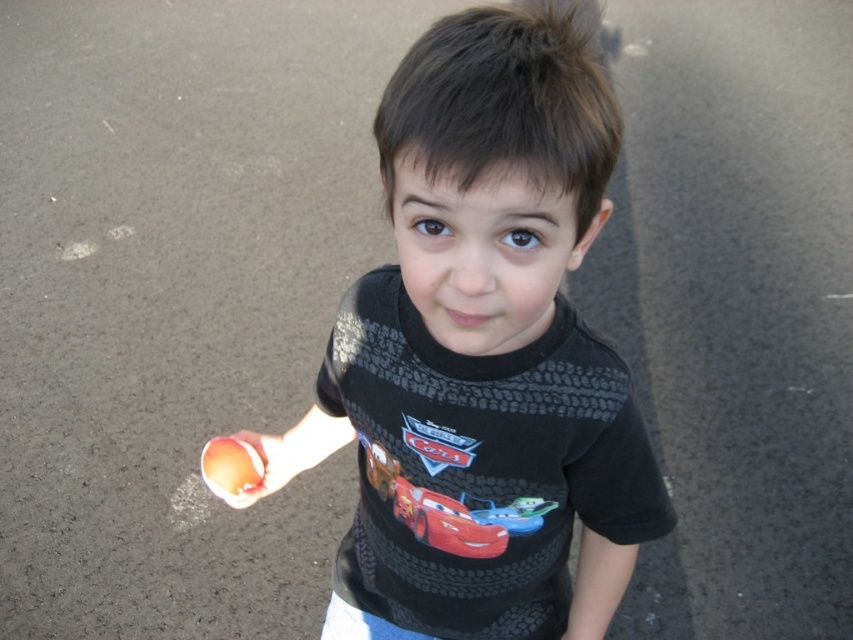
Question: Which point appears farthest from the camera in this image?

Choices:
 (A) (418, 500)
 (B) (276, 467)
 (C) (485, 490)

Answer: (B)

Question: Observing the image, what is the correct spatial positioning of black matte shirt at center in reference to smooth peach at lower left?

Choices:
 (A) right
 (B) left

Answer: (A)

Question: Is black matte shirt at center behind smooth peach at lower left?

Choices:
 (A) yes
 (B) no

Answer: (B)

Question: Is black matte shirt at center bigger than shiny red toy car at center?

Choices:
 (A) yes
 (B) no

Answer: (A)

Question: Which object appears closest to the camera in this image?

Choices:
 (A) smooth peach at lower left
 (B) shiny red toy car at center

Answer: (B)

Question: Which point is farther to the camera?

Choices:
 (A) (537, 61)
 (B) (258, 436)

Answer: (B)